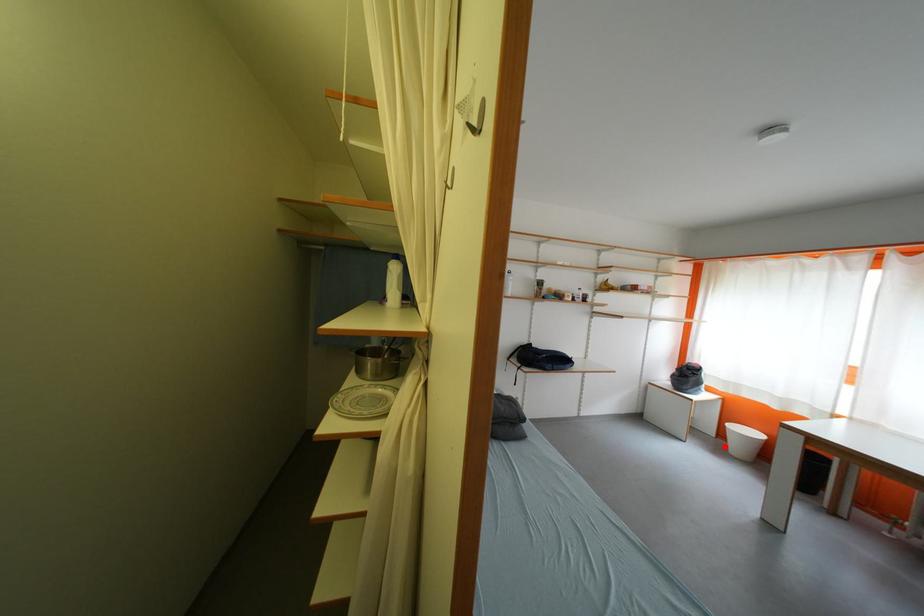
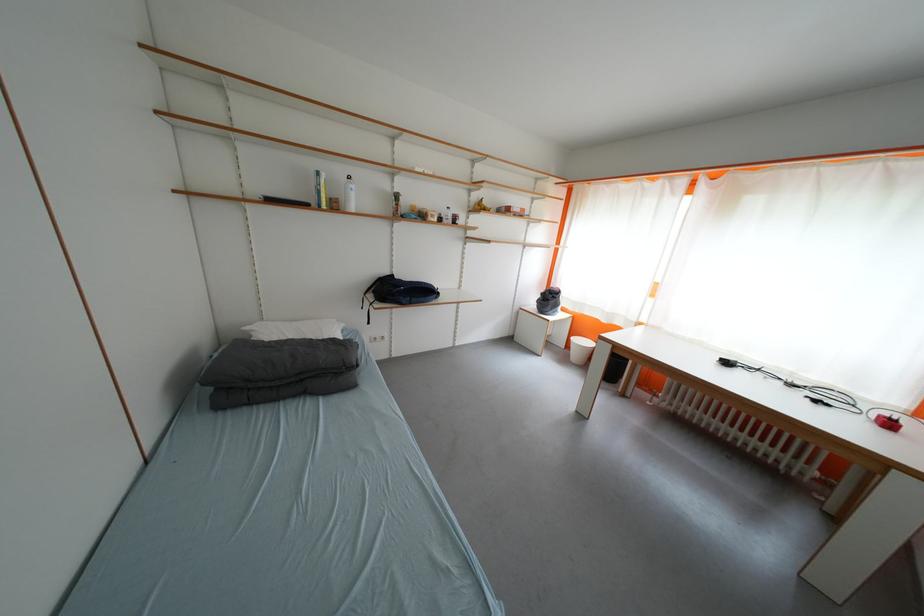
Find the pixel in the second image that matches the highlighted location in the first image.

(572, 358)